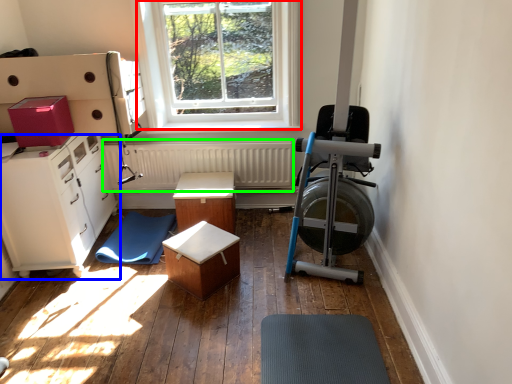
Question: Considering the real-world distances, which object is farthest from window (highlighted by a red box)? cabinetry (highlighted by a blue box) or radiator (highlighted by a green box)?

Choices:
 (A) cabinetry
 (B) radiator

Answer: (A)